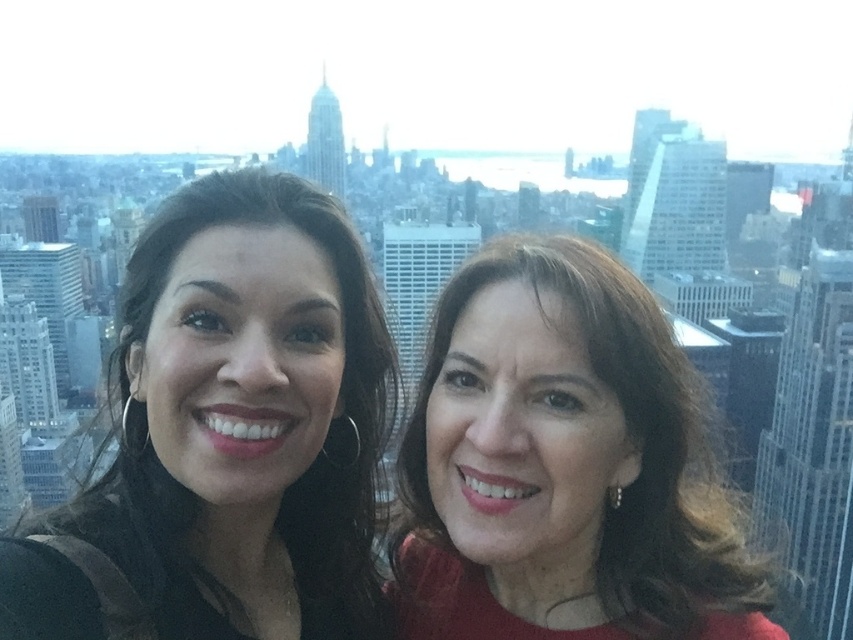
You are a drone operator trying to capture a photo of the city skyline. Your camera has a maximum zoom range of 2000 feet. There is a specific point in the scene at coordinates point (216, 540) that you want to focus on. Can your camera zoom far enough to clearly capture details at that point?

The point (216, 540) is 2058.39 feet from the camera. Since the camera can only zoom up to 2000 feet, it cannot capture details at that distance.

You are a photographer trying to capture a photo of both the matte black hair at center and the matte red dress at center in the same frame. Given that your camera has a maximum zoom range of 100 meters, can you fit both subjects into the frame without moving closer?

The distance between the matte black hair at center and the matte red dress at center is 140.81 meters. Since the camera can only zoom up to 100 meters, it won not be possible to capture both subjects in the same frame without moving closer.